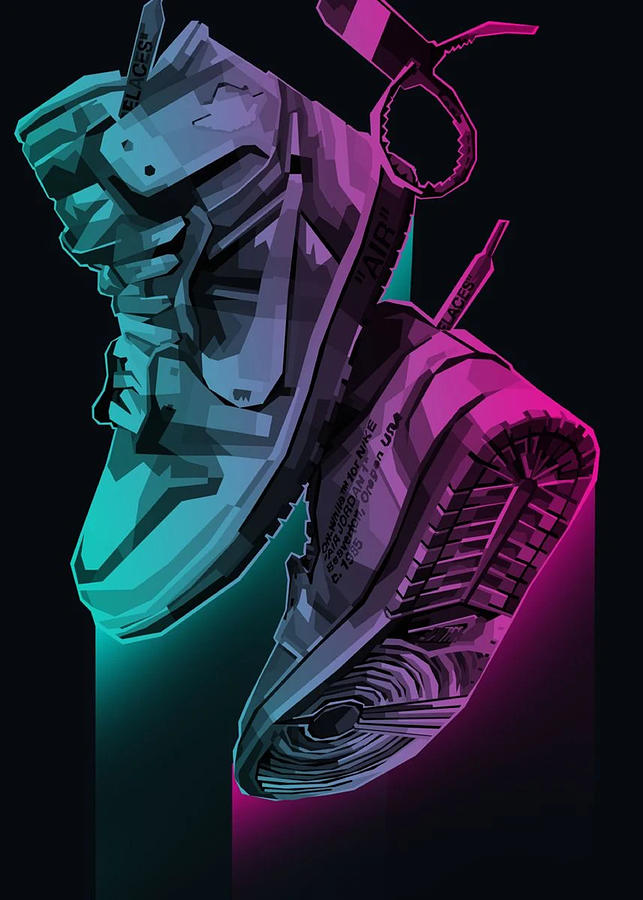
Identify the location of lace. The height and width of the screenshot is (900, 643). (451, 306).